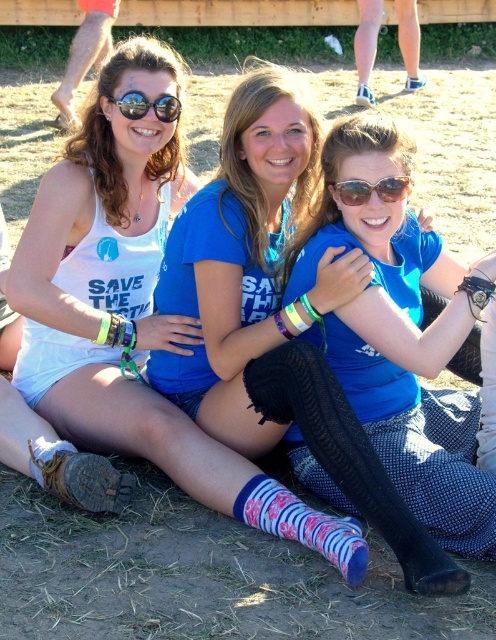
Question: Does striped cotton socks at lower center have a smaller size compared to brown suede boot at lower left?

Choices:
 (A) no
 (B) yes

Answer: (A)

Question: Among these objects, which one is nearest to the camera?

Choices:
 (A) white matte tank top at center
 (B) blue cotton shirt at center
 (C) brown suede boot at lower left

Answer: (A)

Question: Can you confirm if white matte tank top at center is bigger than brown suede boot at lower left?

Choices:
 (A) no
 (B) yes

Answer: (B)

Question: Is striped cotton socks at lower center to the left of brown suede boot at lower left from the viewer's perspective?

Choices:
 (A) yes
 (B) no

Answer: (B)

Question: Among these objects, which one is farthest from the camera?

Choices:
 (A) white matte tank top at center
 (B) black reflective sunglasses at upper center
 (C) blue cotton shirt at center

Answer: (B)

Question: Which object is the farthest from the black reflective sunglasses at upper center?

Choices:
 (A) brown suede boot at lower left
 (B) white matte tank top at center
 (C) striped cotton socks at lower center

Answer: (C)